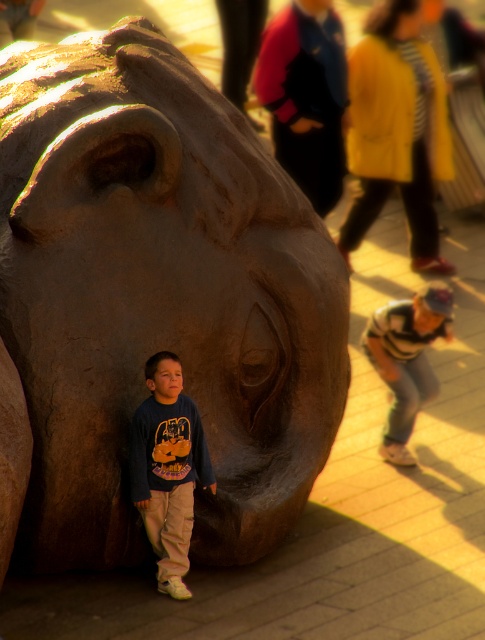
In the scene shown: You are standing in the same position as the boy in the image and want to pick up your dark blue sweatshirt at lower left. Which direction should you move to reach it?

The dark blue sweatshirt at lower left is located at point 0.733 on the x axis and 0.346 on the y axis, so you should move towards the lower left direction to reach it.

You are a fashion designer observing the scene. You notice two garments in the image, the dark blue sweatshirt at lower left and the striped sweater at lower right. Which one has a narrower width?

The dark blue sweatshirt at lower left is thinner than the striped sweater at lower right, so the dark blue sweatshirt at lower left has a narrower width.